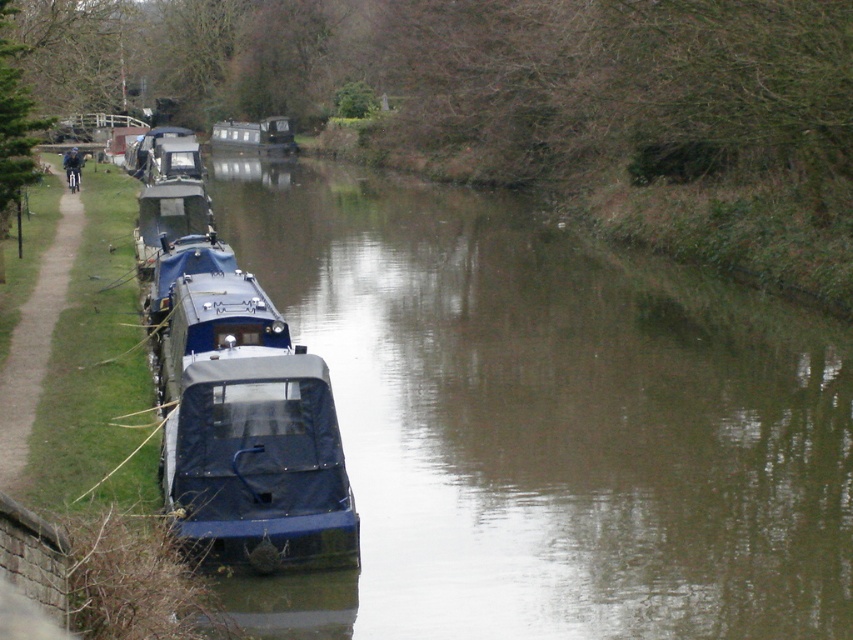
Question: Observing the image, what is the correct spatial positioning of blue rubber boat at left in reference to blue matte boat at center?

Choices:
 (A) right
 (B) left

Answer: (A)

Question: Does blue rubber boat at left have a smaller size compared to blue matte boat at center?

Choices:
 (A) no
 (B) yes

Answer: (A)

Question: Which point is farther from the camera taking this photo?

Choices:
 (A) (254, 150)
 (B) (408, 385)

Answer: (A)

Question: Can you confirm if blue rubber boat at left is positioned below blue matte boat at center?

Choices:
 (A) no
 (B) yes

Answer: (B)

Question: Among these objects, which one is nearest to the camera?

Choices:
 (A) blue rubber boat at left
 (B) blue matte boat at center

Answer: (A)